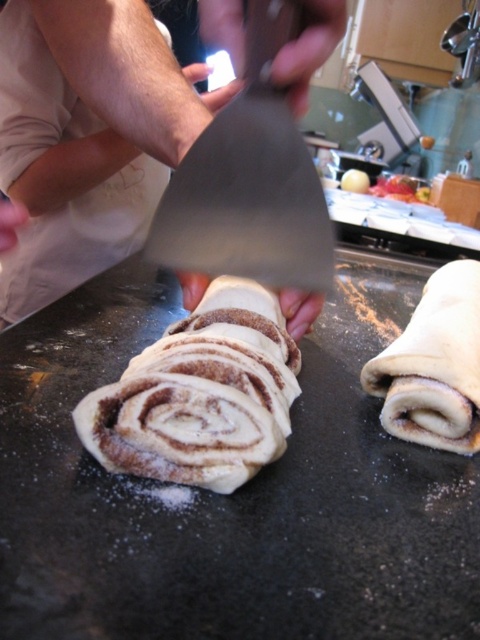
Is point (178, 88) positioned after point (267, 1)?

Yes, it is behind point (267, 1).

Does brown dough at center have a larger size compared to metallic silver spatula at center?

Indeed, brown dough at center has a larger size compared to metallic silver spatula at center.

Is point (38, 6) farther from viewer compared to point (260, 202)?

Yes, point (38, 6) is behind point (260, 202).

Locate an element on the screen. brown dough at center is located at coordinates (108, 100).

Is cinnamon-sugar swirl pastry at center in front of metallic silver spatula at center?

No, it is behind metallic silver spatula at center.

Between cinnamon-sugar swirl pastry at center and metallic silver spatula at center, which one appears on the right side from the viewer's perspective?

metallic silver spatula at center

Which is in front, point (231, 356) or point (261, 104)?

Point (261, 104)

At what (x,y) coordinates should I click in order to perform the action: click on cinnamon-sugar swirl pastry at center. Please return your answer as a coordinate pair (x, y). This screenshot has width=480, height=640. Looking at the image, I should click on (201, 394).

Which is in front, point (68, 20) or point (276, 400)?

Positioned in front is point (276, 400).

Where is `brown dough at center`? This screenshot has width=480, height=640. brown dough at center is located at coordinates (108, 100).

Is point (128, 164) closer to camera compared to point (210, 468)?

That is False.

The image size is (480, 640). I want to click on brown dough at center, so click(108, 100).